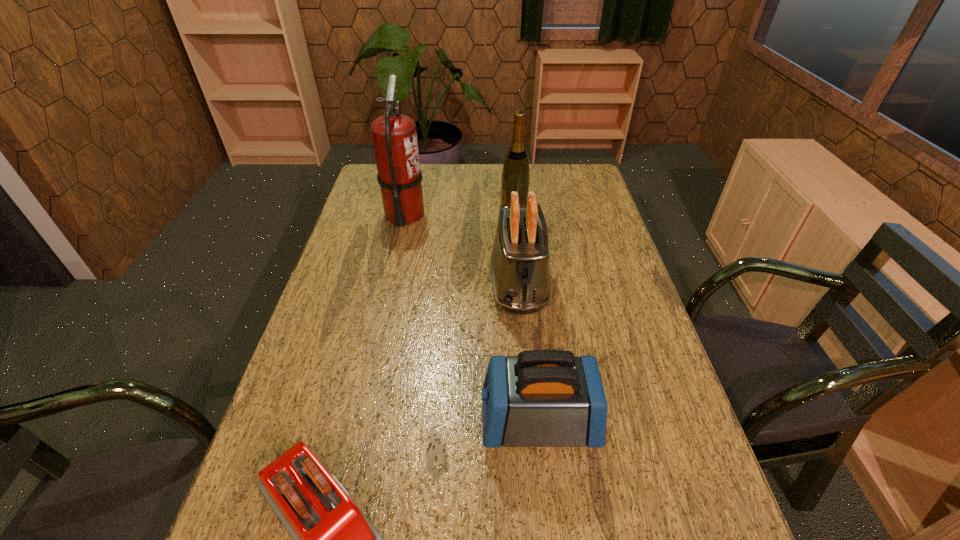
Find the location of a particular element. The height and width of the screenshot is (540, 960). vacant space located on the front-facing side of the second shortest toaster is located at coordinates (412, 421).

At what (x,y) coordinates should I click in order to perform the action: click on free space located 0.220m on the front-facing side of the second shortest toaster. Please return your answer as a coordinate pair (x, y). Image resolution: width=960 pixels, height=540 pixels. Looking at the image, I should click on (379, 421).

The height and width of the screenshot is (540, 960). In order to click on vacant region located on the front-facing side of the second shortest toaster in this screenshot , I will do `click(417, 421)`.

Locate an element on the screen. object situated at the left edge is located at coordinates (394, 135).

Locate an element on the screen. vacant space at the far edge is located at coordinates (472, 177).

In the image, there is a desktop. Identify the location of vacant region at the left edge. Image resolution: width=960 pixels, height=540 pixels. (329, 312).

The height and width of the screenshot is (540, 960). What are the coordinates of `vacant space at the right edge` in the screenshot? It's located at (642, 310).

Identify the location of free region at the far right corner of the desktop. tap(599, 192).

In order to click on free space between the second shortest toaster and the wine bottle in this screenshot , I will do `click(526, 315)`.

Identify the location of unoccupied position between the tallest toaster and the tallest object. The image size is (960, 540). tap(462, 249).